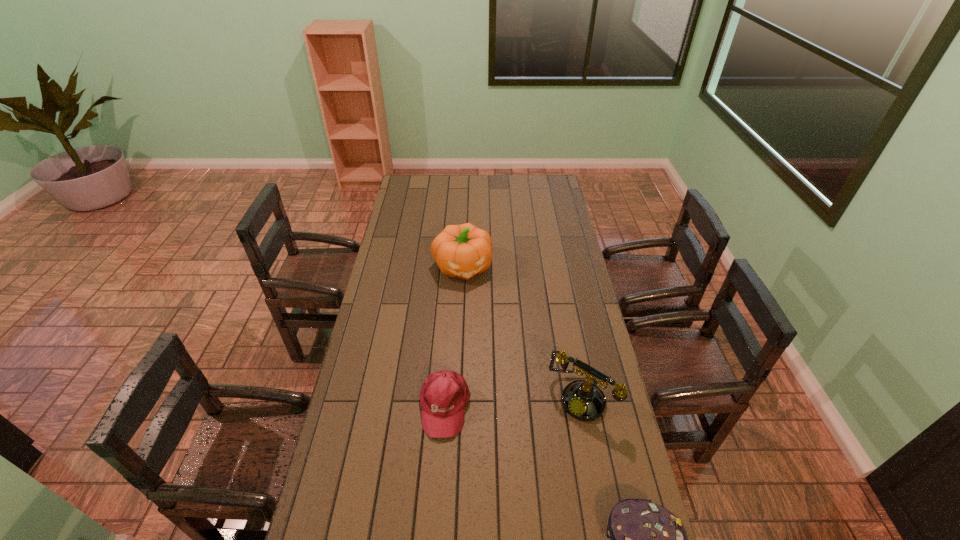
The image size is (960, 540). I want to click on the second closest object to the baseball cap, so click(643, 539).

Locate an element on the screen. the closest object to the nearest object is located at coordinates (584, 401).

Locate an element on the screen. The width and height of the screenshot is (960, 540). vacant space that satisfies the following two spatial constraints: 1. on the front side of the pumpkin; 2. on the right side of the telephone is located at coordinates (455, 399).

Find the location of a particular element. The image size is (960, 540). free location that satisfies the following two spatial constraints: 1. on the front side of the farthest object; 2. on the right side of the telephone is located at coordinates (455, 399).